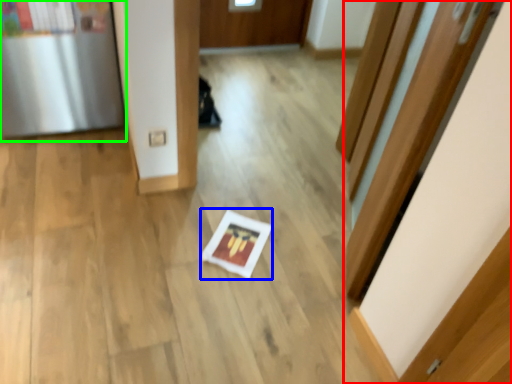
Question: Which is farther away from door (highlighted by a red box)? copy (highlighted by a blue box) or fridge (highlighted by a green box)?

Choices:
 (A) copy
 (B) fridge

Answer: (B)